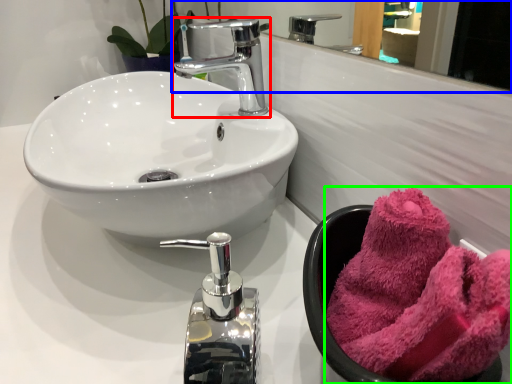
Question: Estimate the real-world distances between objects in this image. Which object is closer to tap (highlighted by a red box), mirror (highlighted by a blue box) or towel/napkin (highlighted by a green box)?

Choices:
 (A) mirror
 (B) towel/napkin

Answer: (B)